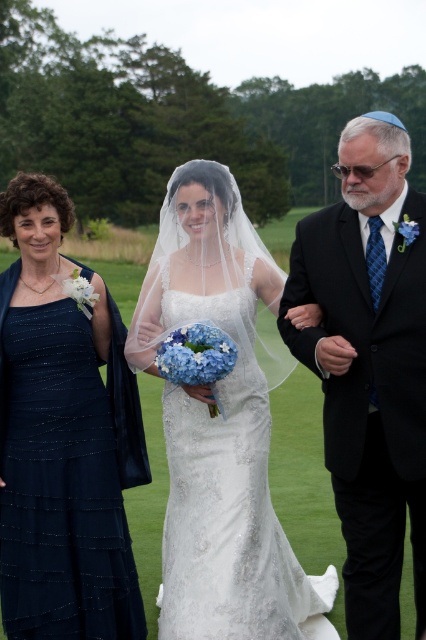
You are standing at the point with coordinates (x=31, y=490) and want to walk to the point with coordinates (x=184, y=529). Based on the wedding scene described, will you be moving towards the foreground or the background?

Point (x=184, y=529) is behind point (x=31, y=490), so moving from (x=31, y=490) to (x=184, y=529) means you are moving towards the background.

You are a photographer setting up for a wedding photo. You need to ensure that the white lace dress at center and the black satin suit at right are both fully visible in the frame. Given their sizes, which one requires more space in the frame horizontally?

The white lace dress at center requires more space in the frame horizontally because its width is larger than the black satin suit at right.